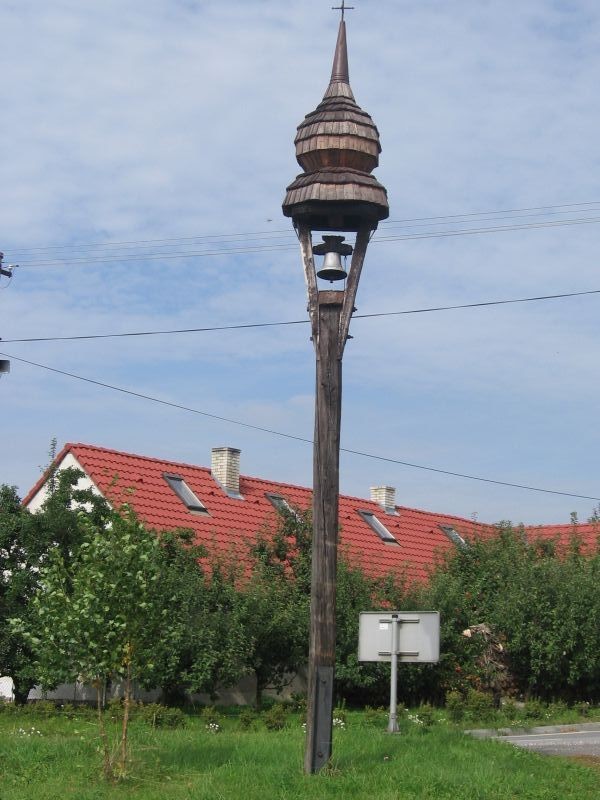
What are the coordinates of `metal sign` in the screenshot? It's located at (413, 629).